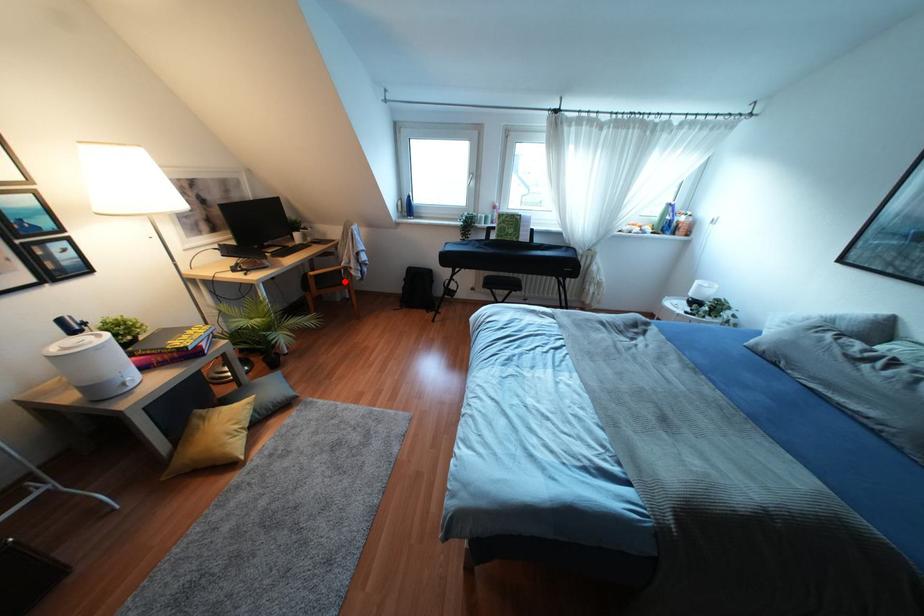
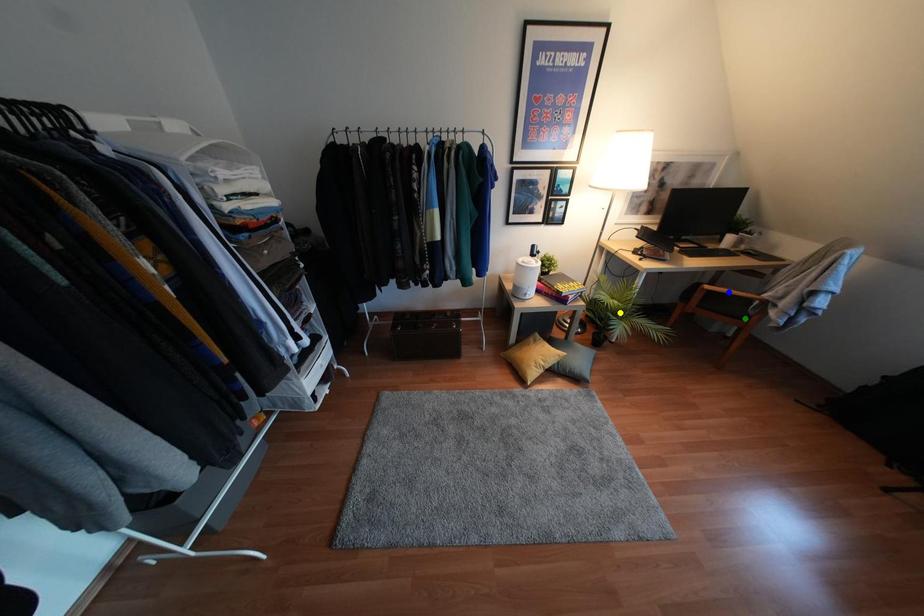
Question: I am providing you with two images of the same scene from different viewpoints. A red point is marked on the first image. You are given multiple points on the second image. Which point in image 2 is actually the same real-world point as the red point in image 1?

Choices:
 (A) green point
 (B) blue point
 (C) yellow point

Answer: (A)